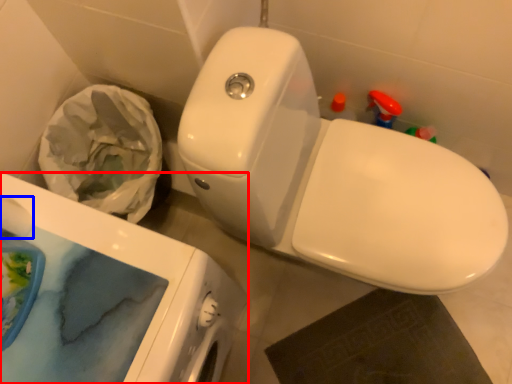
Question: Which of the following is the farthest to the observer, porcelain (highlighted by a red box) or toilet paper (highlighted by a blue box)?

Choices:
 (A) porcelain
 (B) toilet paper

Answer: (B)